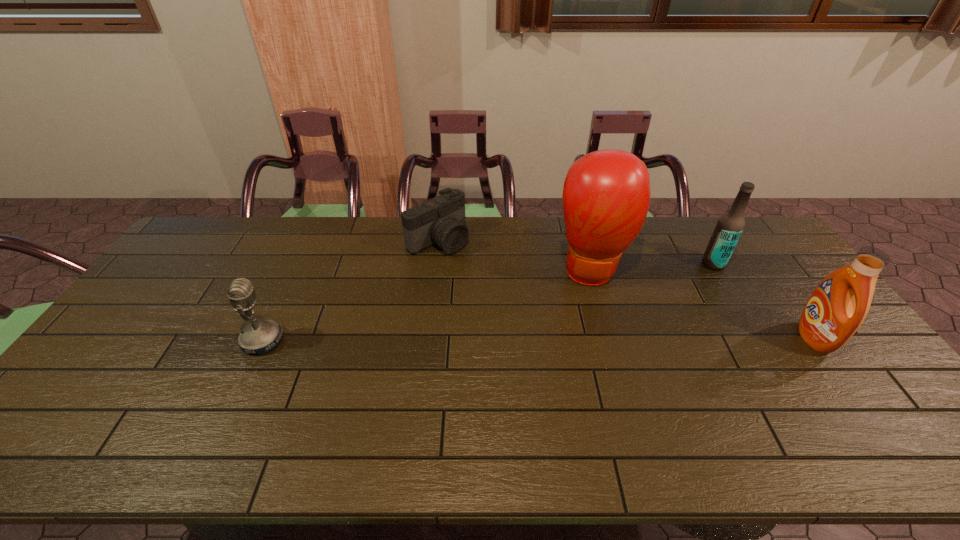
This screenshot has width=960, height=540. In order to click on vacant space situated 0.340m at the lens of the shortest object in this screenshot , I will do `click(530, 309)`.

Identify the location of boxing glove that is positioned at the far edge. (606, 194).

Locate an element on the screen. This screenshot has height=540, width=960. beer bottle that is positioned at the far edge is located at coordinates (730, 225).

This screenshot has width=960, height=540. In order to click on camera positioned at the far edge in this screenshot , I will do `click(441, 220)`.

You are a GUI agent. You are given a task and a screenshot of the screen. Output one action in this format:
    pyautogui.click(x=<x>, y=<y>)
    Task: Click on the object that is positioned at the right edge
    This screenshot has width=960, height=540.
    Given the screenshot: What is the action you would take?
    pyautogui.click(x=838, y=306)

At what (x,y) coordinates should I click in order to perform the action: click on vacant space at the far edge of the desktop. Please return your answer as a coordinate pair (x, y). Looking at the image, I should click on (691, 235).

Locate an element on the screen. The width and height of the screenshot is (960, 540). free region at the near edge of the desktop is located at coordinates (612, 402).

The height and width of the screenshot is (540, 960). Identify the location of blank space at the left edge of the desktop. (128, 352).

This screenshot has width=960, height=540. I want to click on vacant space that's between the second shortest object and the beer bottle, so click(488, 302).

Where is `free space that is in between the microphone and the detergent`? Image resolution: width=960 pixels, height=540 pixels. free space that is in between the microphone and the detergent is located at coordinates (538, 339).